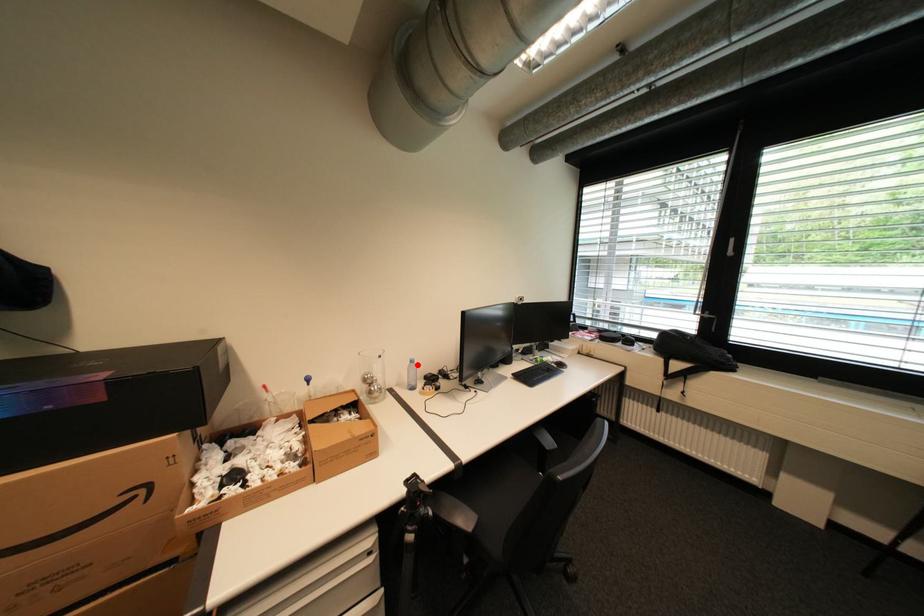
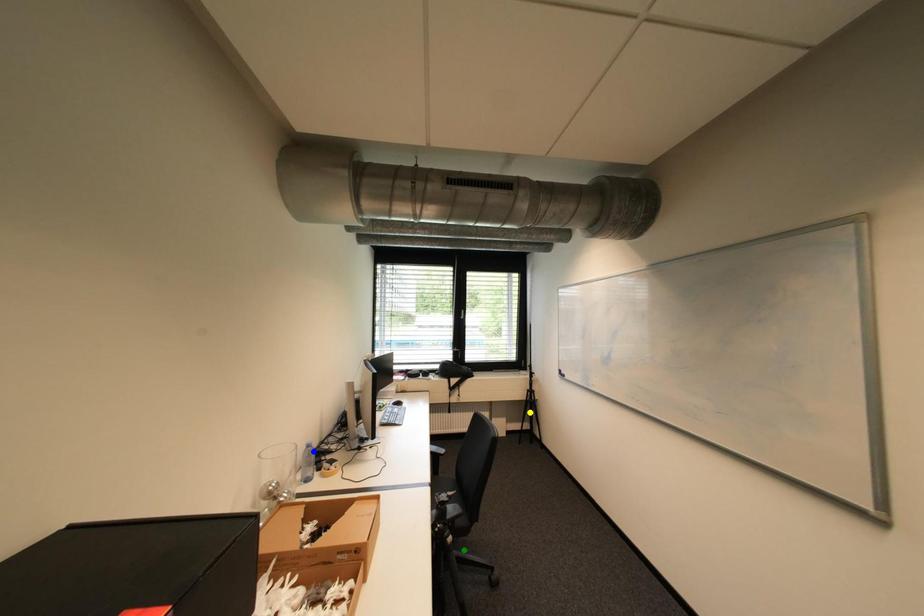
Question: I am providing you with two images of the same scene from different viewpoints. A red point is marked on the first image. You are given multiple points on the second image. Which mark in image 2 goes with the point in image 1?

Choices:
 (A) blue point
 (B) yellow point
 (C) green point

Answer: (A)